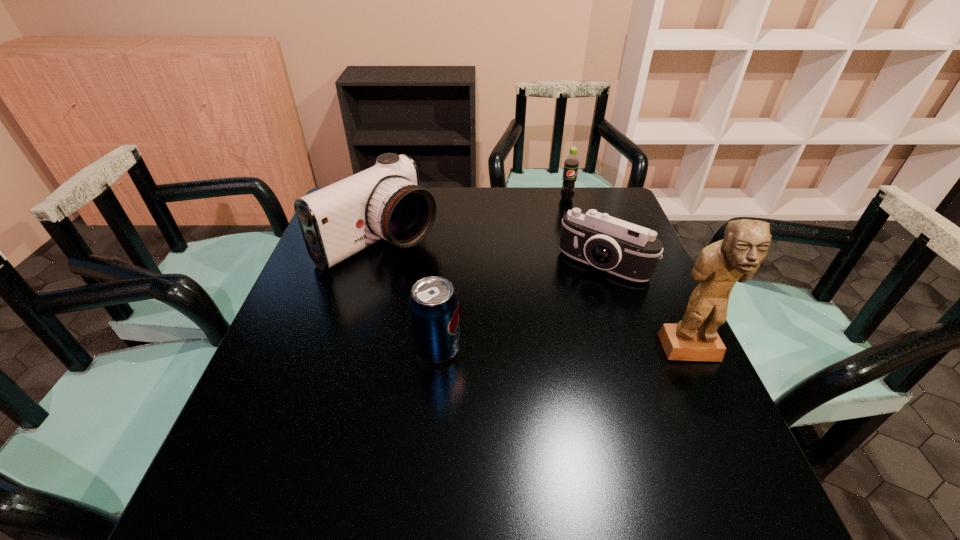
This screenshot has width=960, height=540. Identify the location of the left soda. (433, 303).

At what (x,y) coordinates should I click in order to perform the action: click on the tallest object. Please return your answer as a coordinate pair (x, y). Image resolution: width=960 pixels, height=540 pixels. Looking at the image, I should click on (737, 257).

Find the location of a particular element. This screenshot has height=540, width=960. the farthest object is located at coordinates (571, 163).

Identify the location of the farther soda. This screenshot has height=540, width=960. (571, 163).

At what (x,y) coordinates should I click in order to perform the action: click on camera. Please return your answer as a coordinate pair (x, y). The height and width of the screenshot is (540, 960). Looking at the image, I should click on click(630, 251).

You are a GUI agent. You are given a task and a screenshot of the screen. Output one action in this format:
    pyautogui.click(x=<x>, y=<y>)
    Task: Click on the camcorder
    This screenshot has width=960, height=540.
    Given the screenshot: What is the action you would take?
    pyautogui.click(x=386, y=201)

I want to click on free space located 0.200m on the left of the nearer soda, so click(325, 349).

I want to click on vacant space located on the front-facing side of the tallest object, so click(711, 396).

The image size is (960, 540). I want to click on free point located on the front label of the right soda, so click(576, 276).

Locate an element on the screen. blank space located 0.300m on the front label of the right soda is located at coordinates click(574, 260).